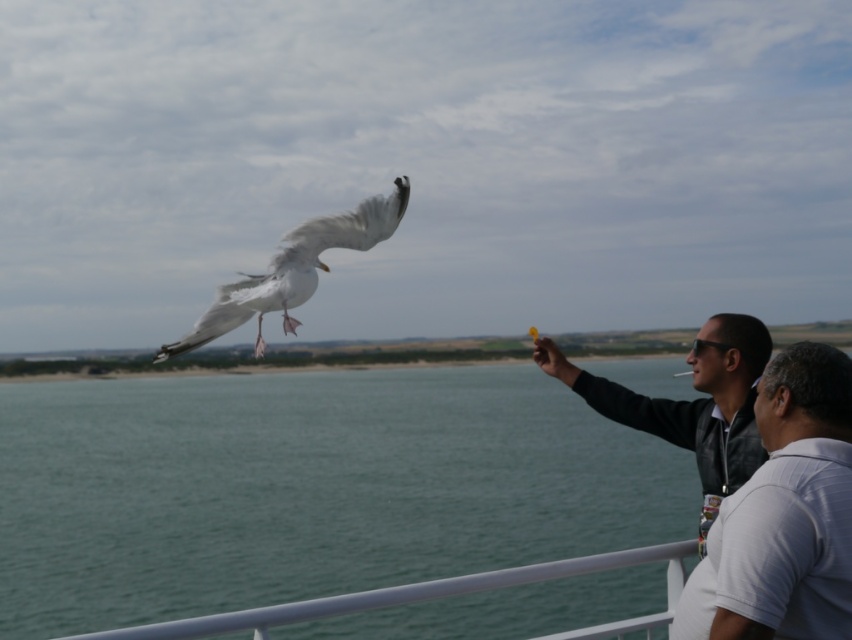
Question: Which point appears closest to the camera in this image?

Choices:
 (A) (559, 378)
 (B) (448, 528)

Answer: (A)

Question: Among these points, which one is nearest to the camera?

Choices:
 (A) (722, 456)
 (B) (455, 477)

Answer: (A)

Question: Can you confirm if green water at lower left is bigger than black leather jacket at right?

Choices:
 (A) no
 (B) yes

Answer: (B)

Question: Observing the image, what is the correct spatial positioning of white striped polo shirt at right in reference to black leather jacket at right?

Choices:
 (A) left
 (B) right

Answer: (B)

Question: From the image, what is the correct spatial relationship of green water at lower left in relation to white striped polo shirt at right?

Choices:
 (A) right
 (B) left

Answer: (B)

Question: Which of the following is the farthest from the observer?

Choices:
 (A) white feathered bird at upper left
 (B) black leather jacket at right

Answer: (A)